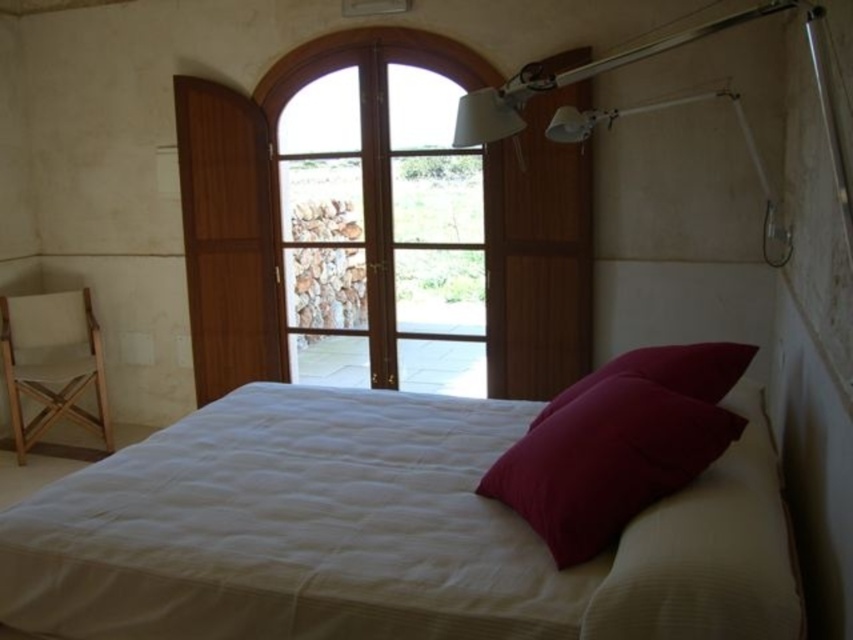
Question: Can you confirm if white quilted bed at center is bigger than velvet red pillow at center?

Choices:
 (A) yes
 (B) no

Answer: (A)

Question: Among these objects, which one is farthest from the camera?

Choices:
 (A) velvet red pillow at center
 (B) clear glass door at center

Answer: (B)

Question: Which point is farther to the camera?

Choices:
 (A) white matte lamp at upper center
 (B) beige fabric chair at left
 (C) matte pink pillow at upper right
 (D) white quilted bed at center

Answer: (B)

Question: Does clear glass door at center appear on the right side of matte pink pillow at upper right?

Choices:
 (A) no
 (B) yes

Answer: (A)

Question: Is white quilted bed at center to the right of white matte lamp at upper center from the viewer's perspective?

Choices:
 (A) yes
 (B) no

Answer: (B)

Question: Which of the following is the closest to the observer?

Choices:
 (A) matte pink pillow at upper right
 (B) beige fabric chair at left
 (C) velvet red pillow at center
 (D) white quilted bed at center

Answer: (D)